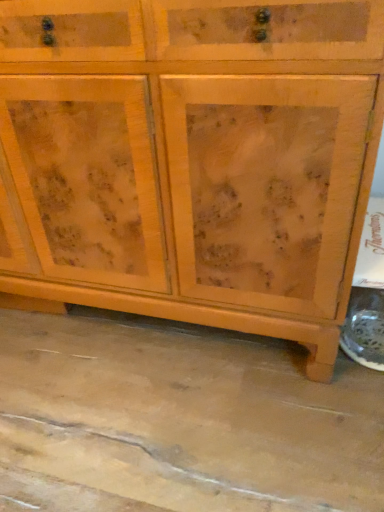
At what (x,y) coordinates should I click in order to perform the action: click on free space in front of natural wood cabinet at center. Please return your answer as a coordinate pair (x, y). Looking at the image, I should click on (160, 418).